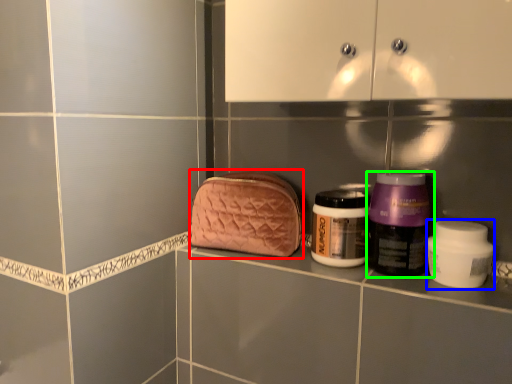
Question: Estimate the real-world distances between objects in this image. Which object is farther from pouch (highlighted by a red box), product (highlighted by a blue box) or bottle (highlighted by a green box)?

Choices:
 (A) product
 (B) bottle

Answer: (A)